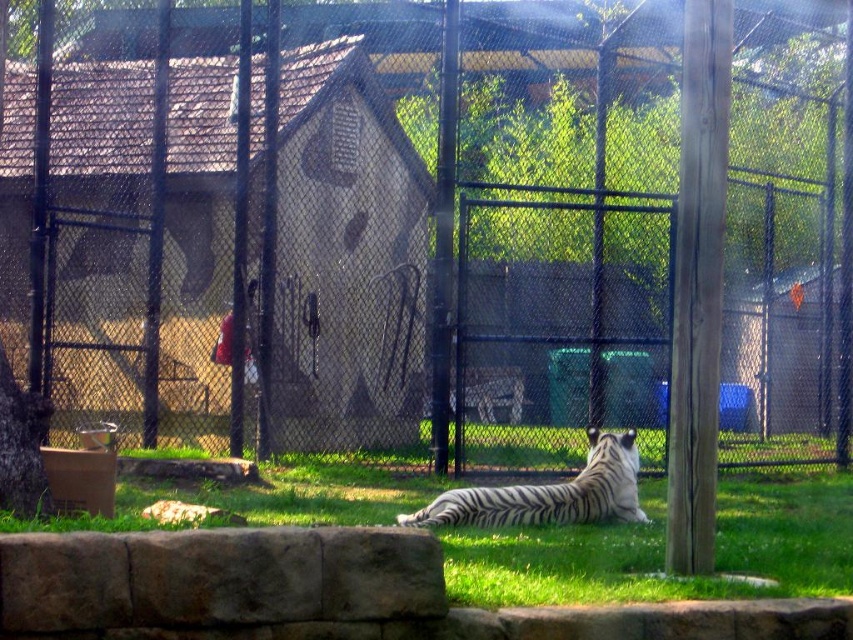
Who is higher up, metal mesh fence at center or white striped tiger at center?

metal mesh fence at center is higher up.

What are the coordinates of `metal mesh fence at center` in the screenshot? It's located at (436, 227).

Can you confirm if metal mesh fence at center is bigger than green grass at center?

No.

Which is behind, point (645, 259) or point (368, 499)?

Positioned behind is point (645, 259).

Is point (550, 60) farther from camera compared to point (419, 492)?

That is True.

Identify the location of metal mesh fence at center. (436, 227).

Consider the image. Does green grass at center have a lesser height compared to white striped tiger at center?

Yes, green grass at center is shorter than white striped tiger at center.

What do you see at coordinates (663, 547) in the screenshot? The height and width of the screenshot is (640, 853). I see `green grass at center` at bounding box center [663, 547].

This screenshot has width=853, height=640. In order to click on green grass at center in this screenshot , I will do `click(663, 547)`.